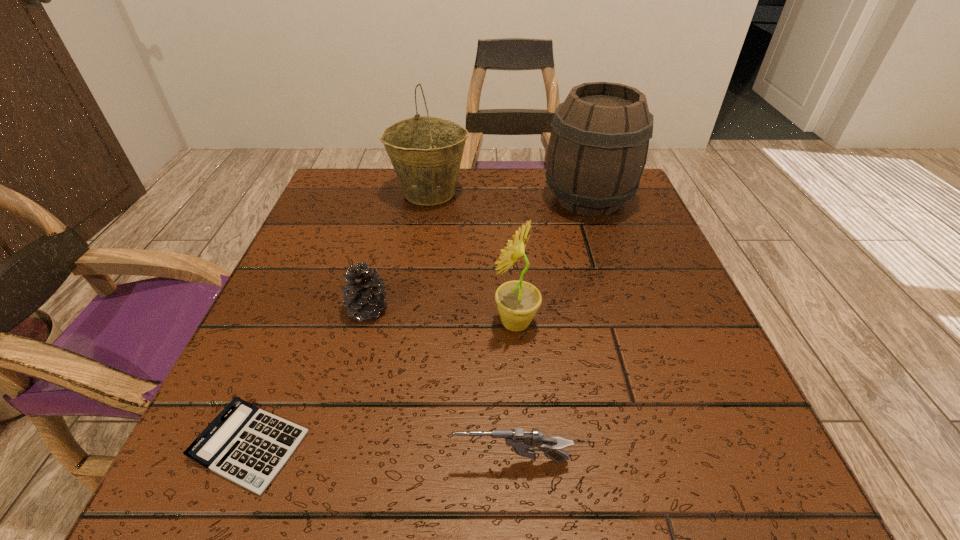
What are the coordinates of `empty space between the sunflower and the left wine bucket` in the screenshot? It's located at (472, 258).

This screenshot has width=960, height=540. What are the coordinates of `vacant area between the calculator and the fourth shortest object` in the screenshot? It's located at (382, 384).

The height and width of the screenshot is (540, 960). I want to click on vacant space that is in between the rightmost object and the left wine bucket, so click(x=509, y=196).

The width and height of the screenshot is (960, 540). I want to click on free space between the left wine bucket and the rightmost object, so click(509, 196).

You are a GUI agent. You are given a task and a screenshot of the screen. Output one action in this format:
    pyautogui.click(x=<x>, y=<y>)
    Task: Click on the vacant space that is in between the pinecone and the shortest object
    Image resolution: width=960 pixels, height=540 pixels.
    Given the screenshot: What is the action you would take?
    pyautogui.click(x=309, y=377)

Locate an element on the screen. This screenshot has width=960, height=540. vacant region between the calculator and the gun is located at coordinates (381, 454).

You are a GUI agent. You are given a task and a screenshot of the screen. Output one action in this format:
    pyautogui.click(x=<x>, y=<y>)
    Task: Click on the vacant space that is in between the fourth tallest object and the calculator
    
    Given the screenshot: What is the action you would take?
    pyautogui.click(x=309, y=377)

The width and height of the screenshot is (960, 540). Identify the location of empty location between the rightmost object and the pinecone. (478, 254).

You are a GUI agent. You are given a task and a screenshot of the screen. Output one action in this format:
    pyautogui.click(x=<x>, y=<y>)
    Task: Click on the blank region between the third shortest object and the left wine bucket
    
    Given the screenshot: What is the action you would take?
    pyautogui.click(x=398, y=251)

Choose which object is the second nearest neighbor to the fourth shortest object. Please provide its 2D coordinates. Your answer should be formatted as a tuple, i.e. [(x, y)], where the tuple contains the x and y coordinates of a point satisfying the conditions above.

[(522, 442)]